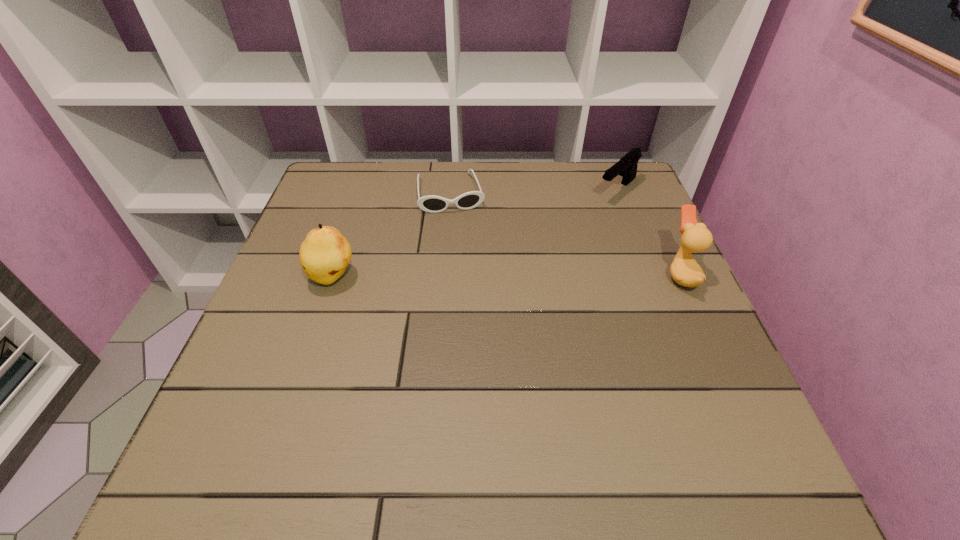
This screenshot has height=540, width=960. What are the coordinates of `free location located on the front-facing side of the third tallest object` in the screenshot? It's located at (545, 254).

Where is `blank space located on the front-facing side of the third tallest object`? The height and width of the screenshot is (540, 960). blank space located on the front-facing side of the third tallest object is located at coordinates (540, 258).

In order to click on free spot located with the lenses of the shortest object facing outward in this screenshot , I will do `click(482, 333)`.

Where is `vacant area located 0.320m with the lenses of the shortest object facing outward`? The height and width of the screenshot is (540, 960). vacant area located 0.320m with the lenses of the shortest object facing outward is located at coordinates (476, 306).

At what (x,y) coordinates should I click in order to perform the action: click on vacant space located 0.060m with the lenses of the shortest object facing outward. Please return your answer as a coordinate pair (x, y). Image resolution: width=960 pixels, height=540 pixels. Looking at the image, I should click on (459, 228).

The width and height of the screenshot is (960, 540). Find the location of `pistol positioned at the far edge`. pistol positioned at the far edge is located at coordinates pyautogui.click(x=626, y=167).

This screenshot has height=540, width=960. I want to click on sunglasses that is at the far edge, so click(433, 204).

What are the coordinates of `object that is at the left edge` in the screenshot? It's located at (325, 253).

The image size is (960, 540). Find the location of `duck at the right edge`. duck at the right edge is located at coordinates (684, 270).

This screenshot has height=540, width=960. Identify the location of pistol that is positioned at the right edge. (626, 167).